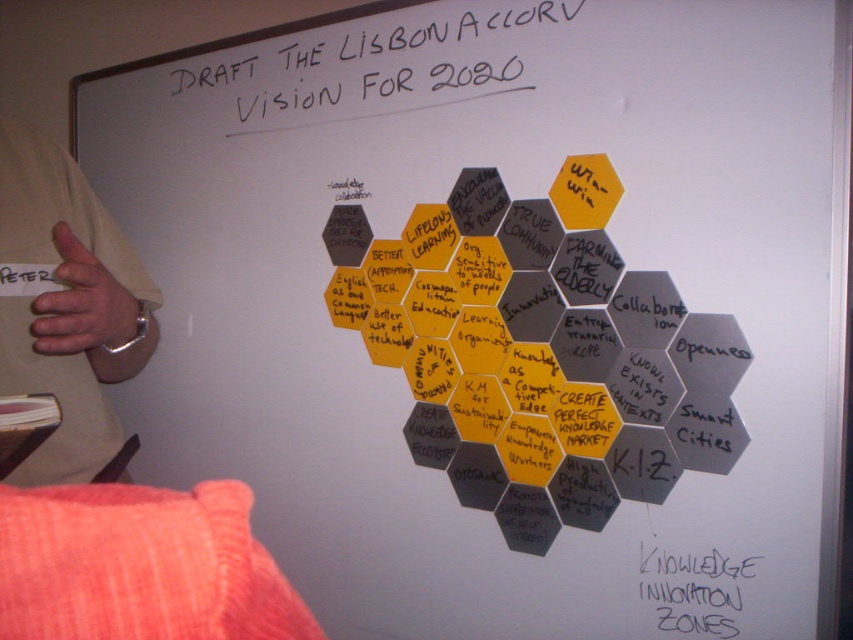
Which of these two, beige fabric at left or white marker text at upper center, stands shorter?

With less height is white marker text at upper center.

What do you see at coordinates (65, 304) in the screenshot? I see `beige fabric at left` at bounding box center [65, 304].

Locate an element on the screen. This screenshot has width=853, height=640. beige fabric at left is located at coordinates (65, 304).

Is white marker text at upper center thinner than black paper at center?

In fact, white marker text at upper center might be wider than black paper at center.

Between point (209, 74) and point (662, 628), which one is positioned in front?

Point (662, 628)

At what (x,y) coordinates should I click in order to perform the action: click on white marker text at upper center. Please return your answer as a coordinate pair (x, y). Looking at the image, I should click on (363, 38).

Can you confirm if beige fabric at left is smaller than black paper at center?

No.

Is point (51, 156) positioned behind point (711, 593)?

Yes, it is.

Identify the location of beige fabric at left. Image resolution: width=853 pixels, height=640 pixels. (65, 304).